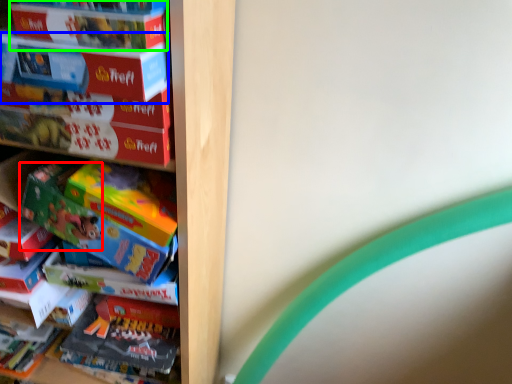
Question: Based on their relative distances, which object is farther from toy (highlighted by a red box)? Choose from paperback book (highlighted by a blue box) and paperback book (highlighted by a green box).

Choices:
 (A) paperback book
 (B) paperback book

Answer: (B)